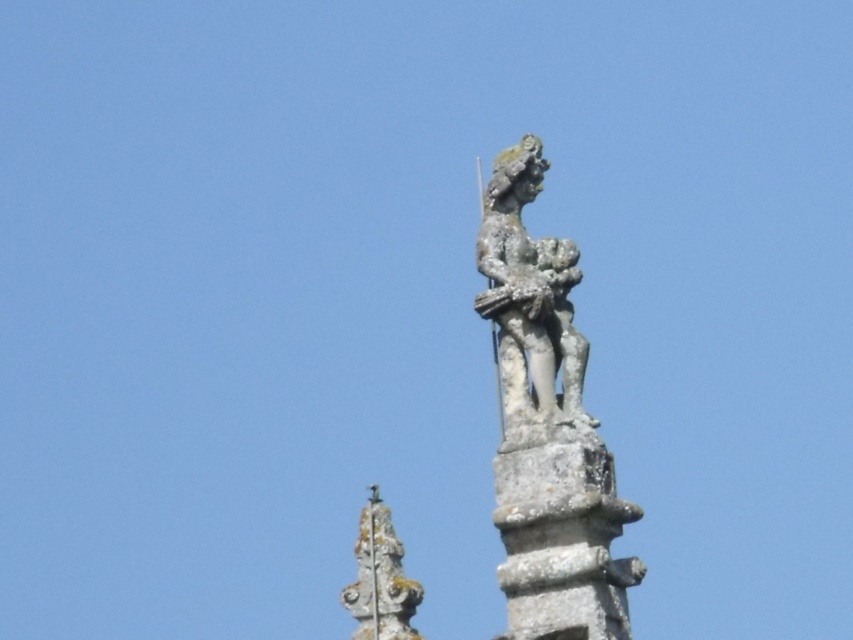
Question: Which object is closer to the camera taking this photo?

Choices:
 (A) stone statue at center
 (B) rusty stone statue at upper center

Answer: (B)

Question: Among these objects, which one is nearest to the camera?

Choices:
 (A) rusty stone statue at upper center
 (B) stone statue at center

Answer: (A)

Question: Can you confirm if rusty stone statue at upper center is thinner than stone statue at center?

Choices:
 (A) no
 (B) yes

Answer: (B)

Question: Can you confirm if rusty stone statue at upper center is positioned to the right of stone statue at center?

Choices:
 (A) yes
 (B) no

Answer: (A)

Question: Observing the image, what is the correct spatial positioning of rusty stone statue at upper center in reference to stone statue at center?

Choices:
 (A) above
 (B) below

Answer: (A)

Question: Which object is farther from the camera taking this photo?

Choices:
 (A) stone statue at center
 (B) rusty stone statue at upper center

Answer: (A)